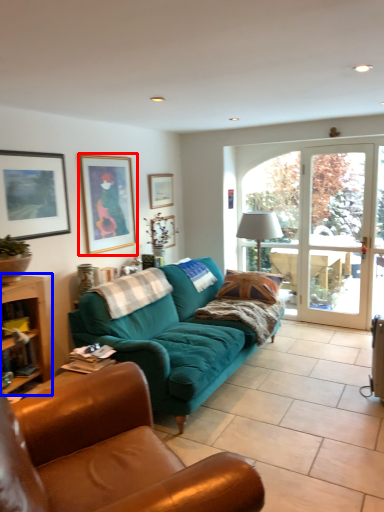
Question: Among these objects, which one is nearest to the camera, picture frame (highlighted by a red box) or table (highlighted by a blue box)?

Choices:
 (A) picture frame
 (B) table

Answer: (B)